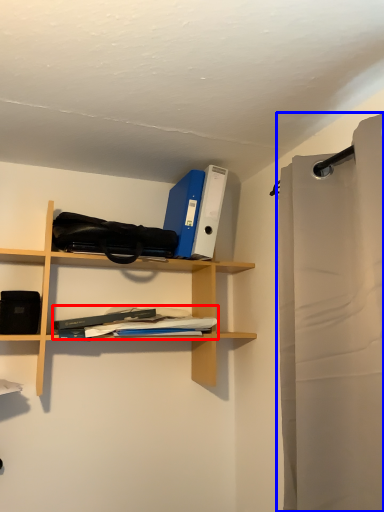
Question: Which point is closer to the camera, book (highlighted by a red box) or shower curtain (highlighted by a blue box)?

Choices:
 (A) book
 (B) shower curtain

Answer: (B)